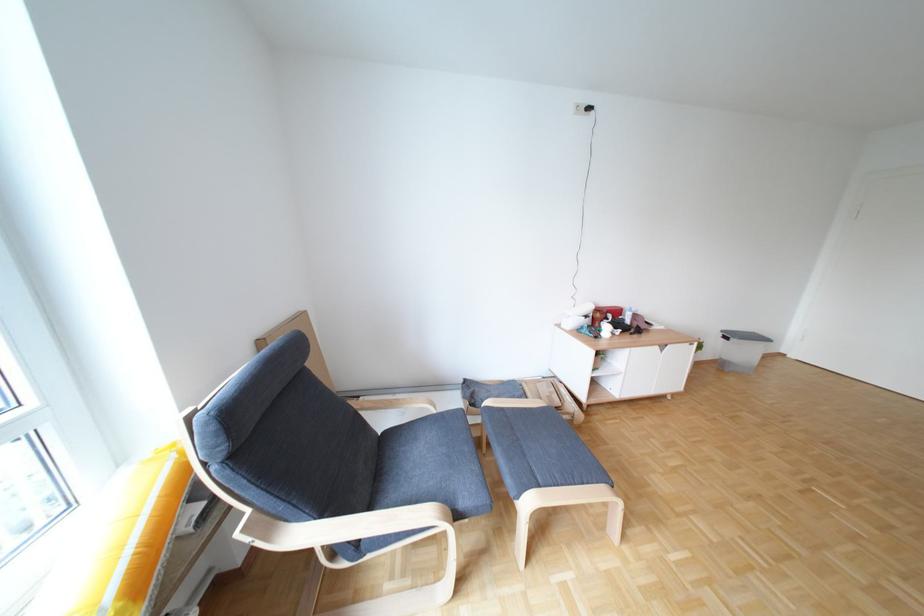
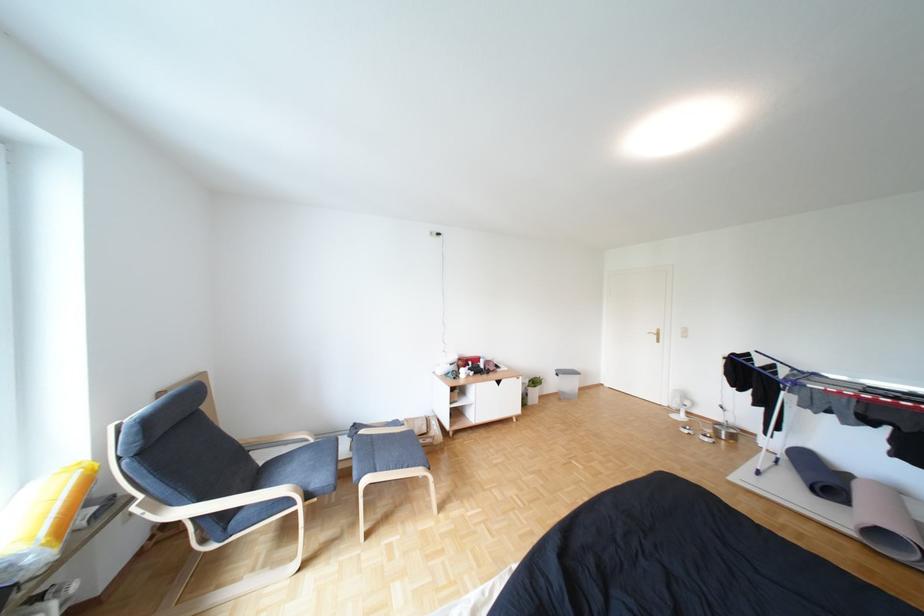
From the picture: What movement of the cameraman would produce the second image?

The cameraman moved toward right, backward.